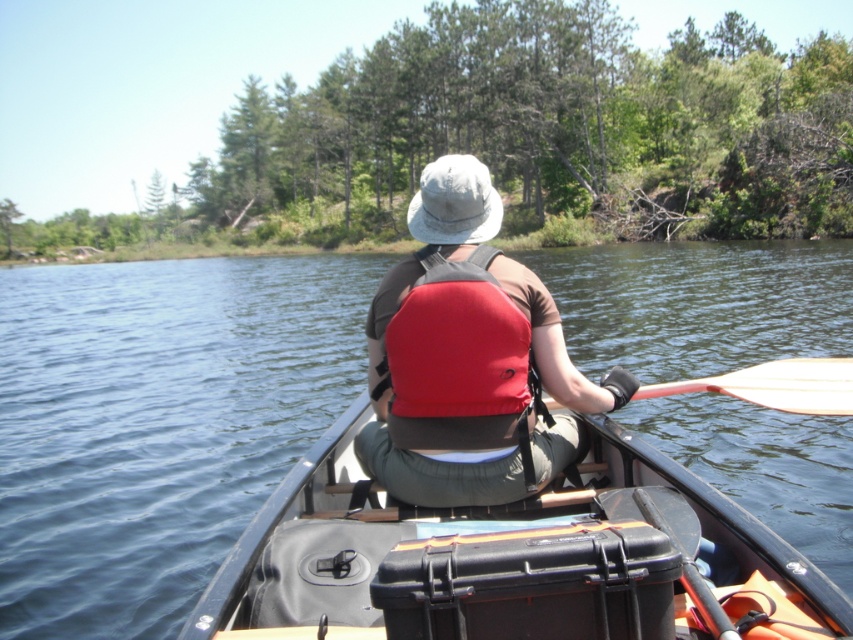
You are standing on the shore and want to board the black plastic boat at center and the red fabric life vest at center. Which object should you approach first to get closer to the boat?

You should approach the black plastic boat at center first because it is closer to you than the red fabric life vest at center.

You are a safety inspector checking the equipment of the canoe. The red fabric life jacket at center and wooden smooth paddle at right must meet specific size requirements. According to regulations, the life jacket must be larger than the paddle. Is the current setup compliant?

The red fabric life jacket at center has a smaller size compared to wooden smooth paddle at right, which violates the regulation requiring the life jacket to be larger than the paddle. The setup is not compliant.